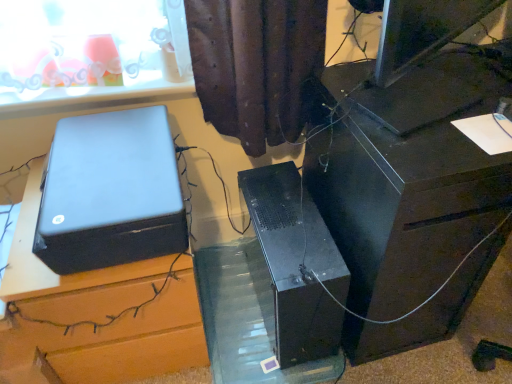
Question: Is transparent plastic glass table at center spatially inside black plastic speaker at upper left, positioned as the 2th furniture in right-to-left order, or outside of it?

Choices:
 (A) outside
 (B) inside

Answer: (A)

Question: Is point (226, 374) closer or farther from the camera than point (150, 326)?

Choices:
 (A) farther
 (B) closer

Answer: (A)

Question: Which object is the farthest from the satin black printer at left?

Choices:
 (A) black plastic speaker at upper left, placed as the 1th furniture when sorted from left to right
 (B) transparent plastic glass table at center
 (C) black plastic desk at right, positioned as the 1th furniture in right-to-left order
 (D) black matte computer tower at center

Answer: (C)

Question: Considering the real-world distances, which object is closest to the black matte computer tower at center?

Choices:
 (A) transparent plastic glass table at center
 (B) black plastic speaker at upper left, positioned as the 2th furniture in right-to-left order
 (C) black plastic desk at right, positioned as the 1th furniture in right-to-left order
 (D) satin black printer at left

Answer: (A)